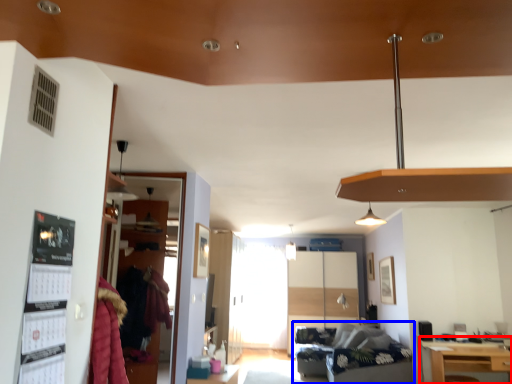
Question: Among these objects, which one is farthest to the camera, table (highlighted by a red box) or studio couch (highlighted by a blue box)?

Choices:
 (A) table
 (B) studio couch

Answer: (B)